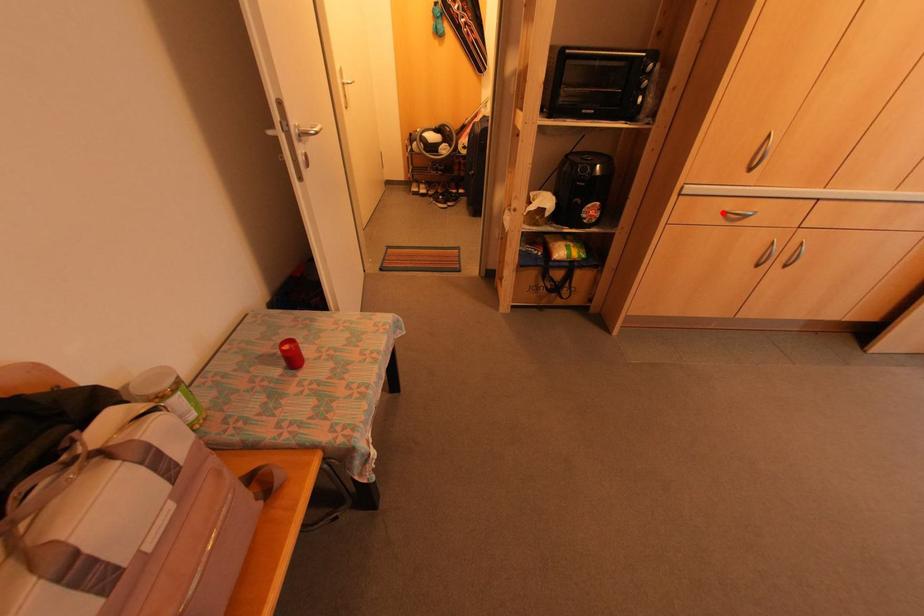
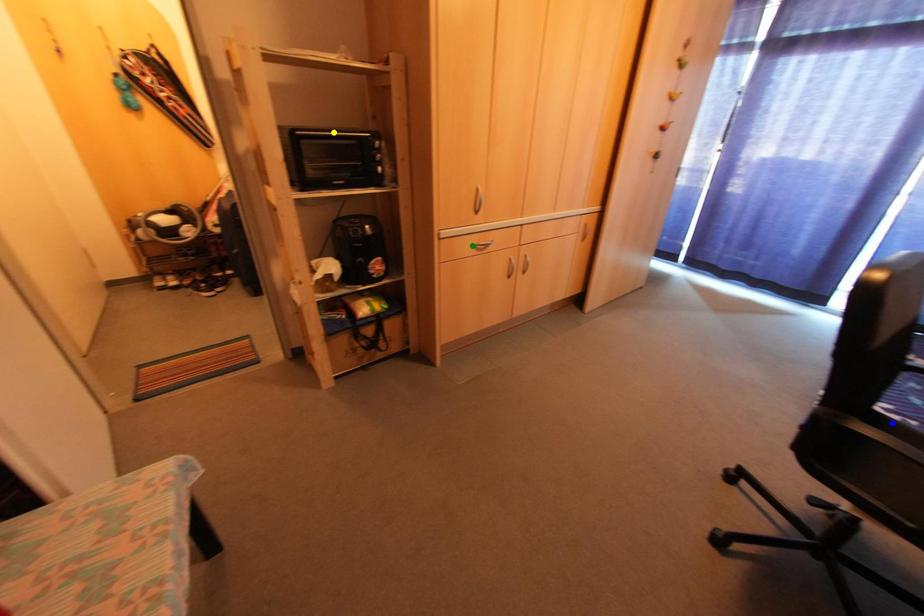
Question: I am providing you with two images of the same scene from different viewpoints. A red point is marked on the first image. You are given multiple points on the second image. Which point in image 2 represents the same 3d spot as the red point in image 1?

Choices:
 (A) blue point
 (B) green point
 (C) yellow point

Answer: (B)